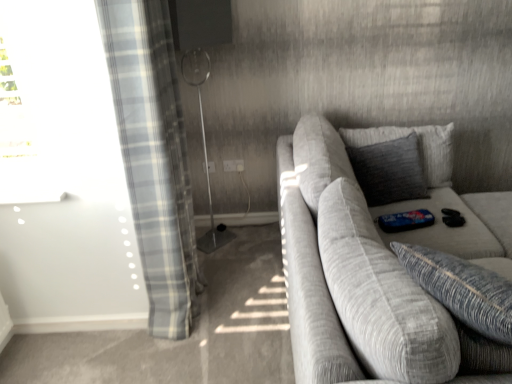
The image size is (512, 384). What do you see at coordinates (390, 170) in the screenshot?
I see `textured gray pillow at upper right` at bounding box center [390, 170].

Identify the location of textured gray couch at right. (381, 264).

From a real-world perspective, between light blue plaid curtain at left and textured gray pillow at upper right, who is vertically lower?

textured gray pillow at upper right, from a real-world perspective.

Is light blue plaid curtain at left further to the viewer compared to textured gray pillow at upper right?

No, it is not.

Is textured gray pillow at upper right at the back of light blue plaid curtain at left?

No, textured gray pillow at upper right is not at the back of light blue plaid curtain at left.

Could textured gray pillow at upper right be considered to be inside light blue plaid curtain at left?

Actually, textured gray pillow at upper right is outside light blue plaid curtain at left.

Does light blue plaid curtain at left have a lesser width compared to textured gray couch at right?

Yes.

Between light blue plaid curtain at left and textured gray couch at right, which one appears on the left side from the viewer's perspective?

light blue plaid curtain at left.

From a real-world perspective, is light blue plaid curtain at left above or below textured gray couch at right?

Clearly, from a real-world perspective, light blue plaid curtain at left is above textured gray couch at right.

Is light blue plaid curtain at left facing away from textured gray couch at right?

No, light blue plaid curtain at left's orientation is not away from textured gray couch at right.

From a real-world perspective, is textured gray couch at right on top of light blue plaid curtain at left?

No, from a real-world perspective, textured gray couch at right is not over light blue plaid curtain at left

How much distance is there between textured gray couch at right and light blue plaid curtain at left?

textured gray couch at right and light blue plaid curtain at left are 33.34 inches apart from each other.

Where is `studio couch located below the light blue plaid curtain at left (from the image's perspective)`? studio couch located below the light blue plaid curtain at left (from the image's perspective) is located at coordinates (381, 264).

In the scene shown: Which is closer, (445, 363) or (183, 228)?

Clearly, point (445, 363) is closer to the camera than point (183, 228).

Between textured gray pillow at upper right and textured gray couch at right, which one is positioned in front?

textured gray couch at right is in front.

Is point (352, 154) less distant than point (447, 351)?

No, it is not.

Can textured gray couch at right be found inside textured gray pillow at upper right?

No, textured gray couch at right is not inside textured gray pillow at upper right.

From their relative heights in the image, would you say textured gray pillow at upper right is taller or shorter than textured gray couch at right?

Considering their sizes, textured gray pillow at upper right has less height than textured gray couch at right.

This screenshot has height=384, width=512. I want to click on studio couch lying on the left of textured gray pillow at upper right, so click(x=381, y=264).

Considering the sizes of objects textured gray couch at right and textured gray pillow at upper right in the image provided, who is bigger, textured gray couch at right or textured gray pillow at upper right?

Bigger between the two is textured gray couch at right.

Is textured gray couch at right shorter than textured gray pillow at upper right?

No, textured gray couch at right is not shorter than textured gray pillow at upper right.

From a real-world perspective, does textured gray pillow at upper right sit lower than light blue plaid curtain at left?

Indeed, from a real-world perspective, textured gray pillow at upper right is positioned beneath light blue plaid curtain at left.

Does textured gray pillow at upper right have a lesser width compared to light blue plaid curtain at left?

Correct, the width of textured gray pillow at upper right is less than that of light blue plaid curtain at left.

Who is taller, textured gray pillow at upper right or light blue plaid curtain at left?

With more height is light blue plaid curtain at left.

This screenshot has width=512, height=384. In order to click on curtain in front of the textured gray pillow at upper right in this screenshot , I will do `click(154, 157)`.

What are the coordinates of `curtain behind the textured gray couch at right` in the screenshot? It's located at (154, 157).

Which object lies further to the anchor point textured gray couch at right, textured gray pillow at upper right or light blue plaid curtain at left?

light blue plaid curtain at left lies further to textured gray couch at right than the other object.

In the scene shown: When comparing their distances from light blue plaid curtain at left, does textured gray pillow at upper right or textured gray couch at right seem closer?

textured gray couch at right lies closer to light blue plaid curtain at left than the other object.

In the scene shown: Considering their positions, is textured gray couch at right positioned closer to textured gray pillow at upper right than light blue plaid curtain at left?

textured gray couch at right lies closer to textured gray pillow at upper right than the other object.

Based on their spatial positions, is light blue plaid curtain at left or textured gray couch at right closer to textured gray pillow at upper right?

The object closer to textured gray pillow at upper right is textured gray couch at right.

When comparing their distances from textured gray couch at right, does light blue plaid curtain at left or textured gray pillow at upper right seem further?

The object further to textured gray couch at right is light blue plaid curtain at left.

Which object lies further to the anchor point light blue plaid curtain at left, textured gray couch at right or textured gray pillow at upper right?

textured gray pillow at upper right.

Locate an element on the screen. The width and height of the screenshot is (512, 384). curtain located between textured gray couch at right and textured gray pillow at upper right in the depth direction is located at coordinates (154, 157).